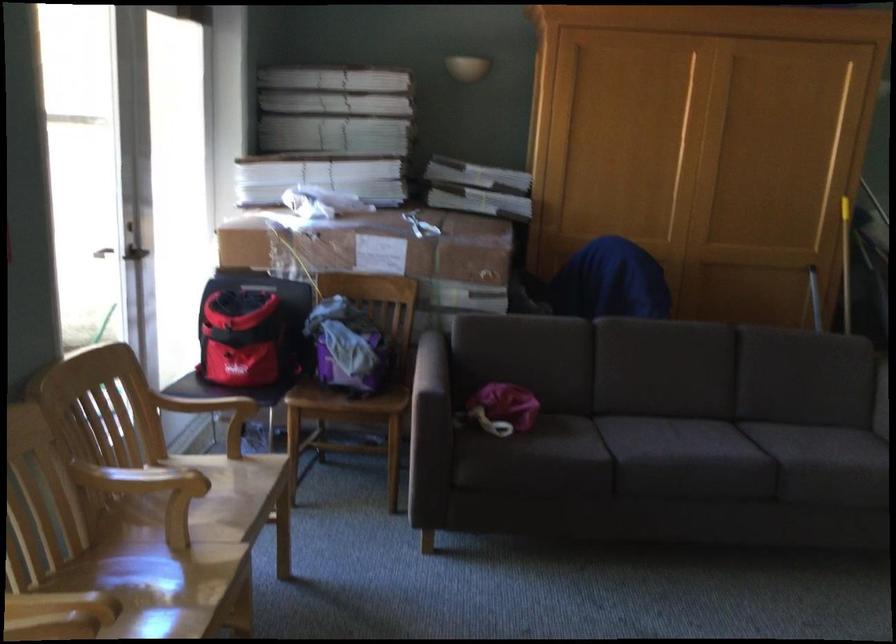
Describe the element at coordinates (169, 590) in the screenshot. I see `the wooden chair sitting surface` at that location.